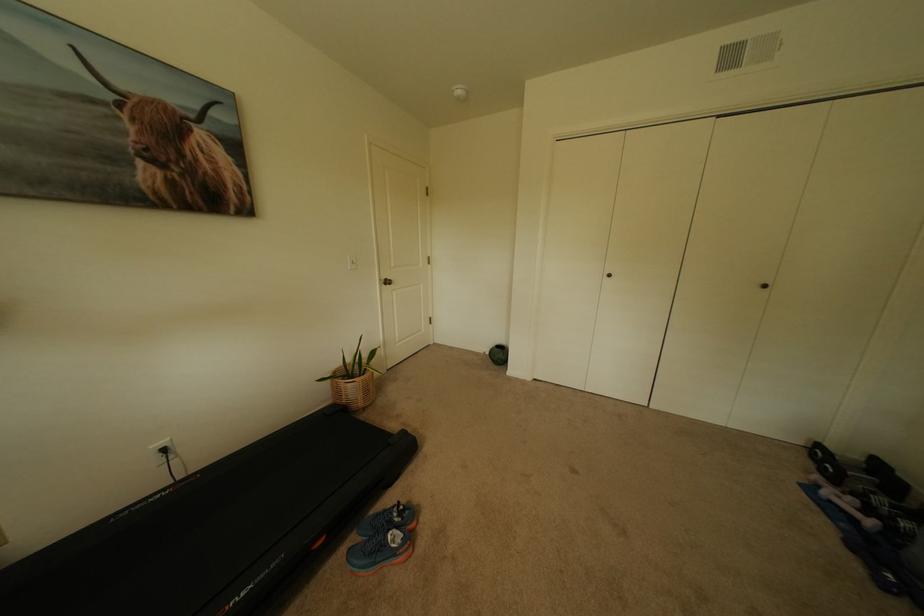
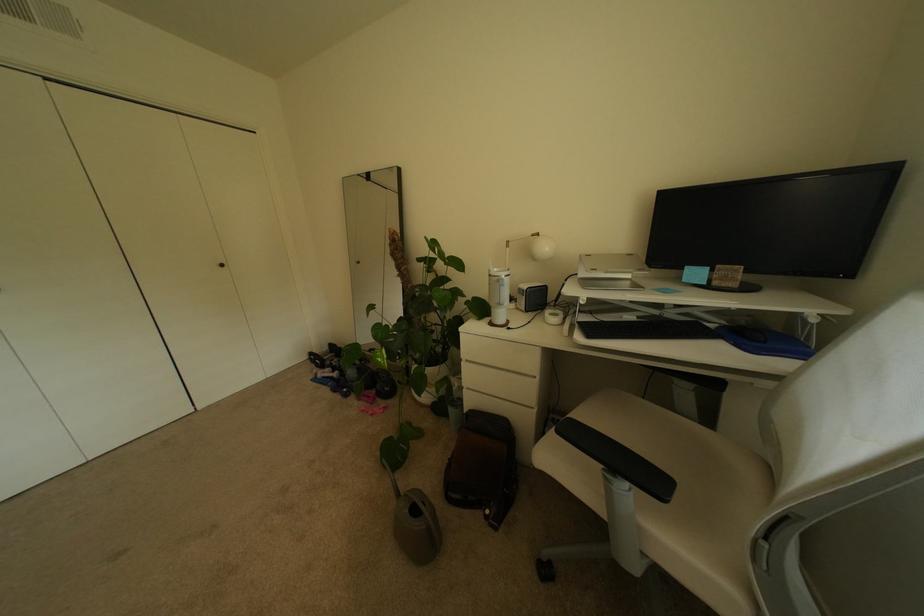
The point at [862,521] is marked in the first image. Where is the corresponding point in the second image?

(341, 379)